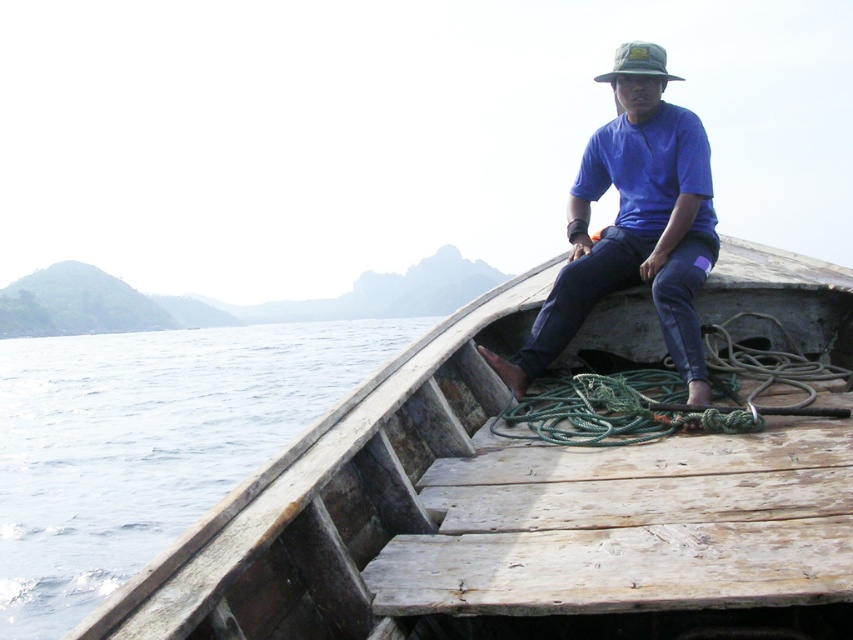
In the scene shown: You are a photographer trying to capture the person in the boat. You notice the blue fabric shirt at upper center and the green fabric hat at upper center. Which of these two items appears smaller in the photo?

The blue fabric shirt at upper center appears smaller in the photo compared to the green fabric hat at upper center.

You are standing on the boat and want to take a photo of the clear blue water at lower left. Where should you point your camera to capture it?

You should point your camera towards the lower left area of the scene, specifically at the coordinates (x=148, y=444), to capture the clear blue water at lower left.

You are an AI analyzing the image. The scene shows a person on a boat. Where exactly is the blue fabric shirt at upper center located in terms of coordinates?

The blue fabric shirt at upper center is located at coordinates point [634,234].